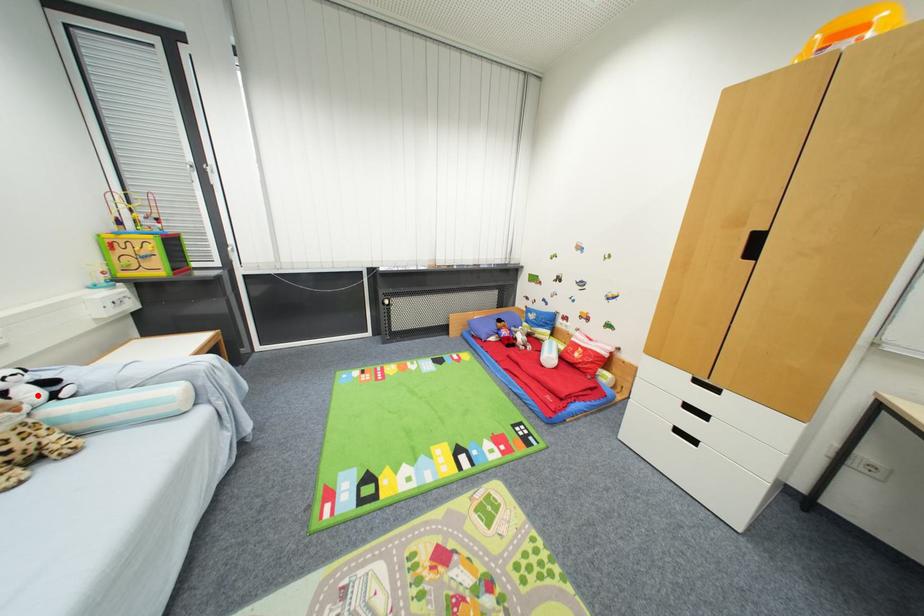
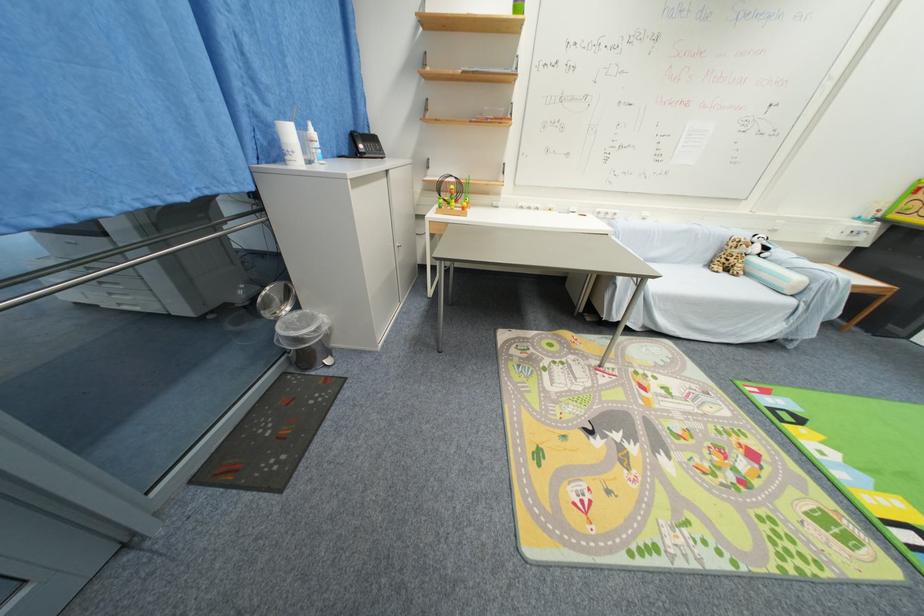
The point at the highlighted location is marked in the first image. Where is the corresponding point in the second image?

(761, 251)